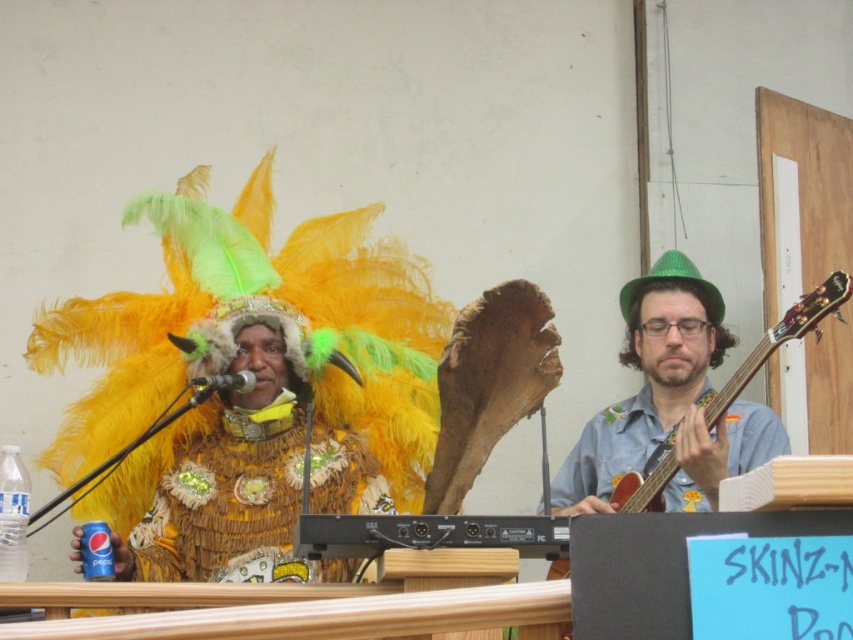
Question: Is shiny gold costume at center thinner than wooden acoustic guitar at right?

Choices:
 (A) no
 (B) yes

Answer: (A)

Question: Which object appears farthest from the camera in this image?

Choices:
 (A) shiny gold costume at center
 (B) wooden acoustic guitar at right

Answer: (B)

Question: Considering the relative positions of shiny gold costume at center and wooden acoustic guitar at right in the image provided, where is shiny gold costume at center located with respect to wooden acoustic guitar at right?

Choices:
 (A) right
 (B) left

Answer: (B)

Question: Can you confirm if shiny gold costume at center is positioned above wooden acoustic guitar at right?

Choices:
 (A) yes
 (B) no

Answer: (A)

Question: Which point appears farthest from the camera in this image?

Choices:
 (A) (254, 470)
 (B) (677, 465)

Answer: (A)

Question: Which of the following is the farthest from the observer?

Choices:
 (A) (260, 536)
 (B) (650, 477)

Answer: (B)